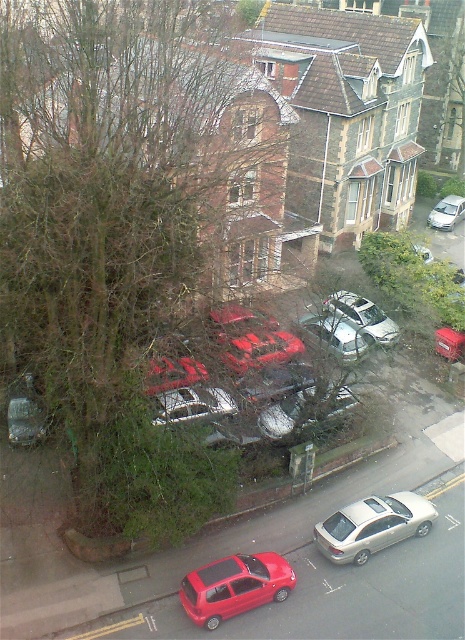
Question: Which object is the closest to the metallic silver sedan at center?

Choices:
 (A) shiny red hatchback at lower center
 (B) green leafy tree at upper left
 (C) satin silver suv at center
 (D) satin silver sedan at lower center

Answer: (C)

Question: Is green leafy tree at upper left positioned in front of metallic silver sedan at center?

Choices:
 (A) no
 (B) yes

Answer: (B)

Question: Considering the relative positions of green leafy tree at upper left and satin silver sedan at lower center in the image provided, where is green leafy tree at upper left located with respect to satin silver sedan at lower center?

Choices:
 (A) right
 (B) left

Answer: (B)

Question: Observing the image, what is the correct spatial positioning of green leafy tree at upper left in reference to satin silver sedan at lower center?

Choices:
 (A) right
 (B) left

Answer: (B)

Question: Which point is closer to the camera taking this photo?

Choices:
 (A) (354, 317)
 (B) (453, 205)

Answer: (A)

Question: Which point is farther to the camera?

Choices:
 (A) (243, 593)
 (B) (431, 209)
 (C) (52, 228)

Answer: (B)